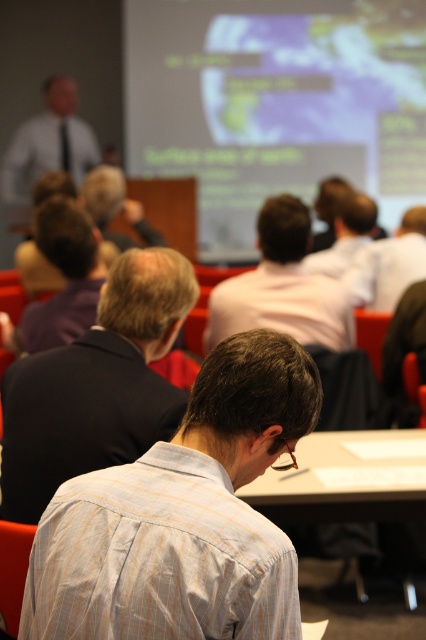
You are standing at the front of the room and want to hand out a document to both the light blue striped shirt at center and the light brown shirt at center. Which one is closer to you?

The light blue striped shirt at center is closer to you since it is 6.12 feet away from the light brown shirt at center.

In the scene shown: You are organizing a presentation and need to ensure that all materials are visible to the audience. Given the light brown shirt at center and the white paper at center on the table, which item takes up more space?

The light brown shirt at center has a larger size compared to the white paper at center, so it takes up more space.